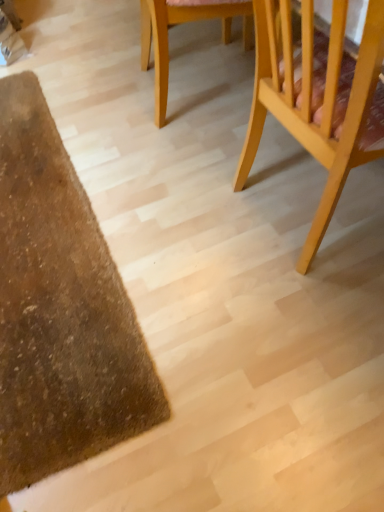
Question: Does light wood chair at upper center, marked as the 2th chair in a right-to-left arrangement, touch light wood chair at right, placed as the 2th chair when sorted from left to right?

Choices:
 (A) no
 (B) yes

Answer: (A)

Question: Can you confirm if light wood chair at upper center, marked as the 2th chair in a right-to-left arrangement, is shorter than light wood chair at right, placed as the 2th chair when sorted from left to right?

Choices:
 (A) yes
 (B) no

Answer: (A)

Question: From a real-world perspective, is light wood chair at upper center, marked as the 2th chair in a right-to-left arrangement, positioned over light wood chair at right, the first chair viewed from the right, based on gravity?

Choices:
 (A) yes
 (B) no

Answer: (B)

Question: Is light wood chair at upper center, marked as the 2th chair in a right-to-left arrangement, not near light wood chair at right, placed as the 2th chair when sorted from left to right?

Choices:
 (A) yes
 (B) no

Answer: (B)

Question: Is light wood chair at upper center, the 1th chair when ordered from left to right, closer to camera compared to light wood chair at right, the first chair viewed from the right?

Choices:
 (A) no
 (B) yes

Answer: (A)

Question: Is light wood chair at upper center, the 1th chair when ordered from left to right, surrounding light wood chair at right, the first chair viewed from the right?

Choices:
 (A) no
 (B) yes

Answer: (A)

Question: Is the depth of light wood chair at right, placed as the 2th chair when sorted from left to right, less than that of light wood chair at upper center, the 1th chair when ordered from left to right?

Choices:
 (A) yes
 (B) no

Answer: (A)

Question: Is light wood chair at right, placed as the 2th chair when sorted from left to right, shorter than light wood chair at upper center, marked as the 2th chair in a right-to-left arrangement?

Choices:
 (A) yes
 (B) no

Answer: (B)

Question: From the image's perspective, does light wood chair at right, the first chair viewed from the right, appear higher than light wood chair at upper center, marked as the 2th chair in a right-to-left arrangement?

Choices:
 (A) no
 (B) yes

Answer: (A)

Question: Is light wood chair at right, the first chair viewed from the right, positioned beyond the bounds of light wood chair at upper center, marked as the 2th chair in a right-to-left arrangement?

Choices:
 (A) no
 (B) yes

Answer: (B)

Question: Does light wood chair at right, placed as the 2th chair when sorted from left to right, appear on the right side of light wood chair at upper center, marked as the 2th chair in a right-to-left arrangement?

Choices:
 (A) no
 (B) yes

Answer: (B)

Question: Is light wood chair at right, the first chair viewed from the right, placed right next to light wood chair at upper center, marked as the 2th chair in a right-to-left arrangement?

Choices:
 (A) yes
 (B) no

Answer: (B)

Question: Considering the positions of light wood chair at right, the first chair viewed from the right, and light wood chair at upper center, marked as the 2th chair in a right-to-left arrangement, in the image, is light wood chair at right, the first chair viewed from the right, wider or thinner than light wood chair at upper center, marked as the 2th chair in a right-to-left arrangement,?

Choices:
 (A) wide
 (B) thin

Answer: (A)